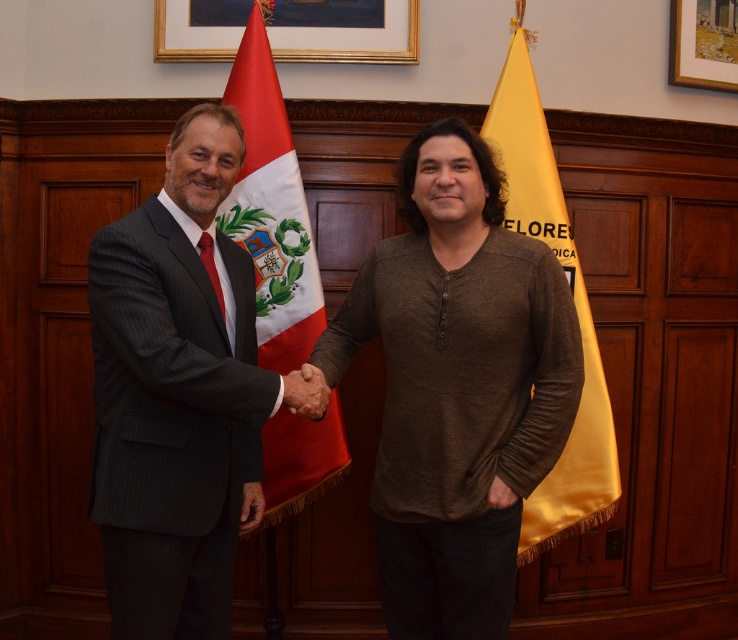
Question: Is gold/gilded picture frame at upper center to the right of wooden picture frame at upper right from the viewer's perspective?

Choices:
 (A) yes
 (B) no

Answer: (B)

Question: Is red/white fabric flag at center smaller than gold/gilded picture frame at upper center?

Choices:
 (A) no
 (B) yes

Answer: (A)

Question: Which point is closer to the camera?

Choices:
 (A) dark gray suit at left
 (B) red/white fabric flag at center
 (C) brown cotton shirt at center
 (D) gold/gilded picture frame at upper center

Answer: (A)

Question: Which of the following is the farthest from the observer?

Choices:
 (A) gold/gilded picture frame at upper center
 (B) yellow satin flag at right
 (C) dark gray suit at left

Answer: (A)

Question: Does red/white fabric flag at center lie behind wooden picture frame at upper right?

Choices:
 (A) no
 (B) yes

Answer: (A)

Question: Among these points, which one is farthest from the camera?

Choices:
 (A) (589, 333)
 (B) (731, 33)

Answer: (B)